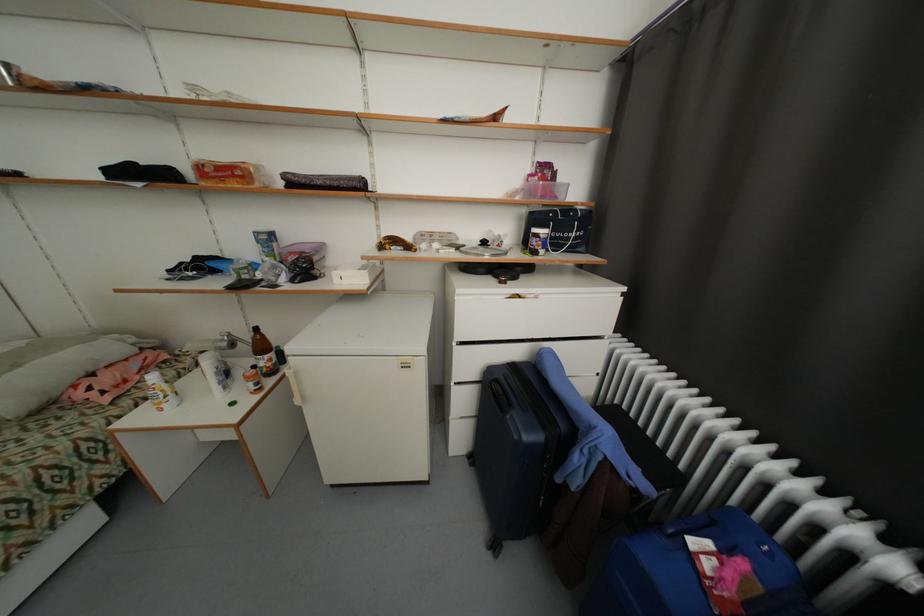
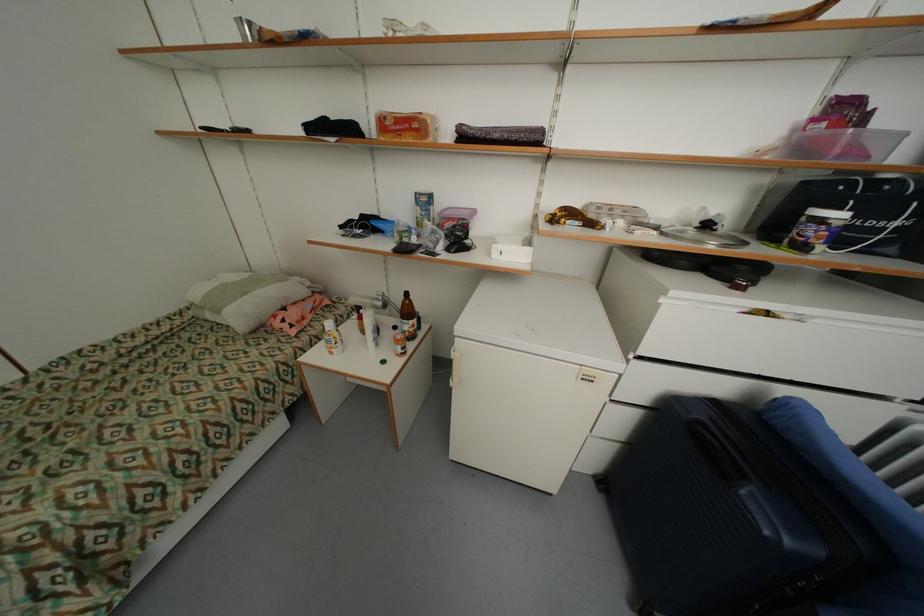
Locate, in the second image, the point that corresponds to point 540,243 in the first image.

(819, 233)